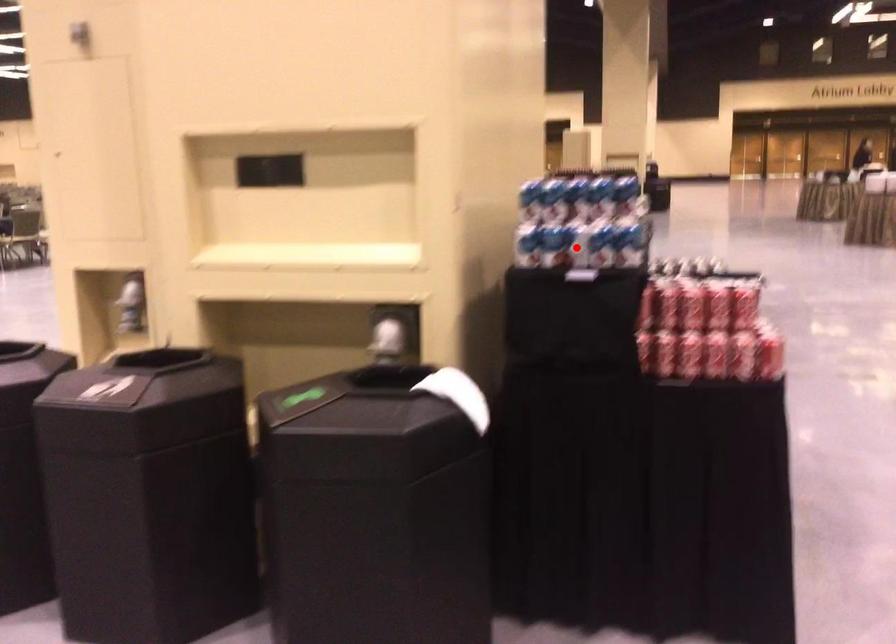
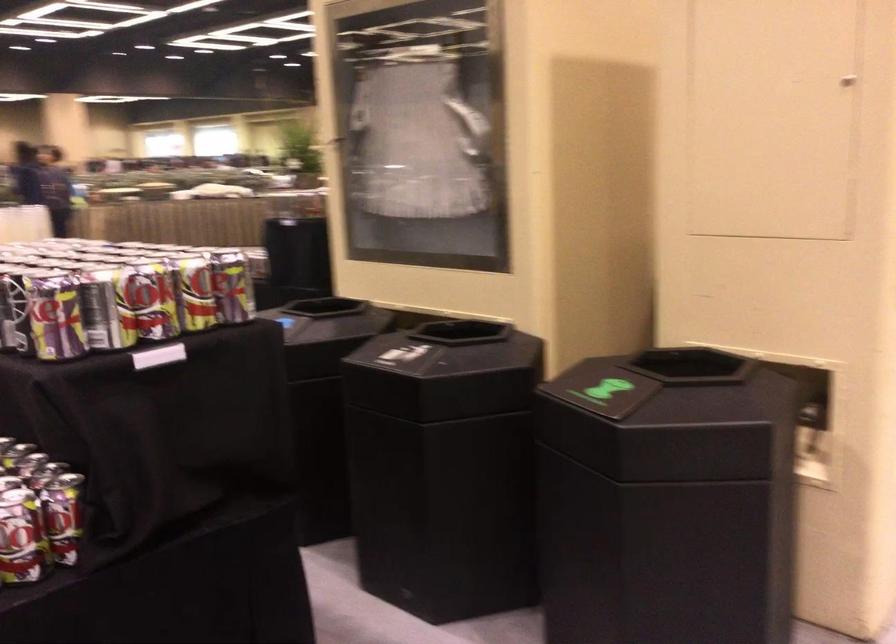
Question: I am providing you with two images of the same scene from different viewpoints. A red point is marked on the first image. Is the red point's position out of view in image 2?

Choices:
 (A) Yes
 (B) No

Answer: (A)